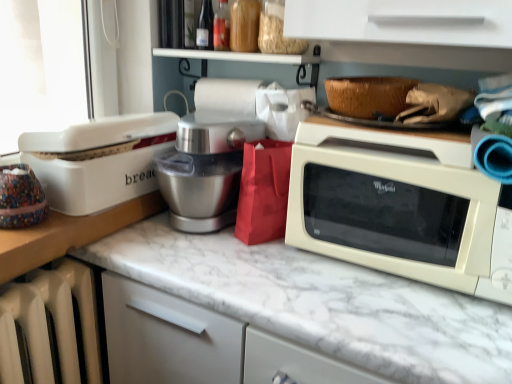
This screenshot has height=384, width=512. Identify the location of vacant area that lies in front of silver metallic mixer at center. (199, 261).